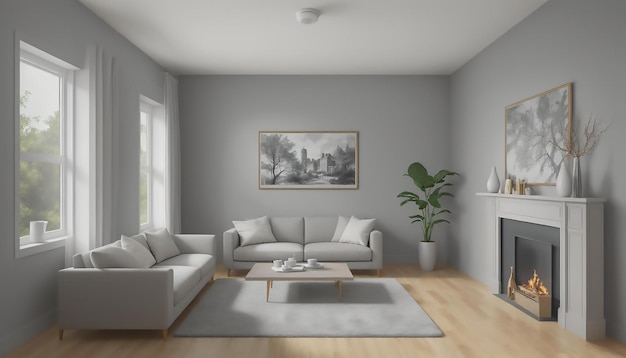
Identify the location of coffee table. (255, 276).